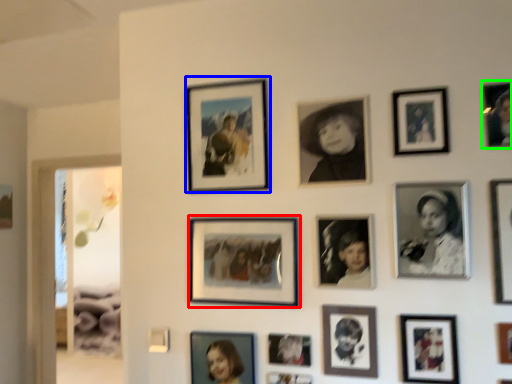
Question: Estimate the real-world distances between objects in this image. Which object is farther from picture frame (highlighted by a red box), picture frame (highlighted by a blue box) or picture frame (highlighted by a green box)?

Choices:
 (A) picture frame
 (B) picture frame

Answer: (B)